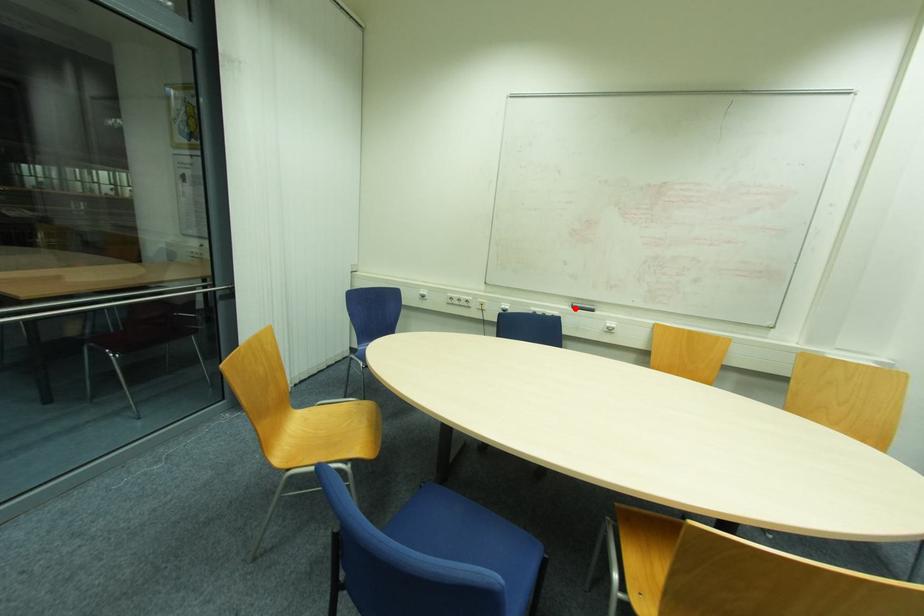
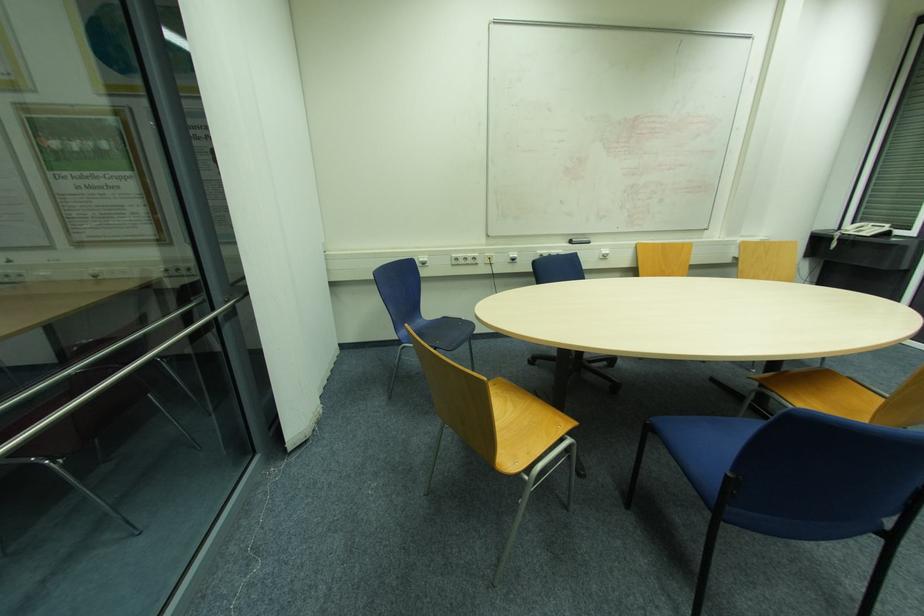
Find the pixel in the second image that matches the highlighted location in the first image.

(574, 244)